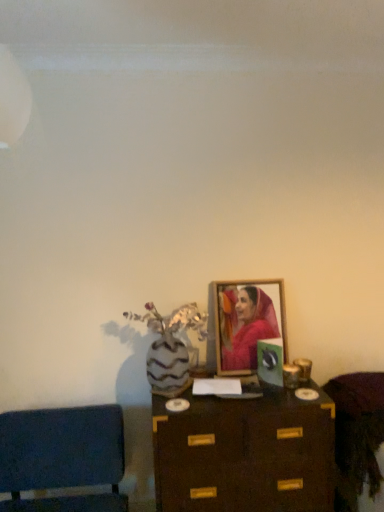
Identify the location of wooden cabinet at lower right, acting as the 1th furniture starting from the right. (357, 435).

Where is `velvet blue cushion at lower left, placed as the 1th furniture when sorted from left to right`? velvet blue cushion at lower left, placed as the 1th furniture when sorted from left to right is located at coordinates (62, 457).

Would you consider brown wooden table at center to be distant from wooden cabinet at lower right, the 2th furniture viewed from the left?

brown wooden table at center is near wooden cabinet at lower right, the 2th furniture viewed from the left, not far away.

How many degrees apart are the facing directions of brown wooden table at center and wooden cabinet at lower right, the 2th furniture viewed from the left?

There is a 0.159-degree angle between the facing directions of brown wooden table at center and wooden cabinet at lower right, the 2th furniture viewed from the left.

Based on their positions, is brown wooden table at center located to the left or right of wooden cabinet at lower right, acting as the 1th furniture starting from the right?

Clearly, brown wooden table at center is on the left of wooden cabinet at lower right, acting as the 1th furniture starting from the right, in the image.

From a real-world perspective, which is physically below, wooden cabinet at lower right, the 2th furniture viewed from the left, or velvet blue cushion at lower left, the 2th furniture in the right-to-left sequence?

In real-world perspective, velvet blue cushion at lower left, the 2th furniture in the right-to-left sequence, is lower.

Does wooden cabinet at lower right, acting as the 1th furniture starting from the right, have a larger size compared to velvet blue cushion at lower left, placed as the 1th furniture when sorted from left to right?

Incorrect, wooden cabinet at lower right, acting as the 1th furniture starting from the right, is not larger than velvet blue cushion at lower left, placed as the 1th furniture when sorted from left to right.

Can you confirm if wooden cabinet at lower right, the 2th furniture viewed from the left, is shorter than velvet blue cushion at lower left, placed as the 1th furniture when sorted from left to right?

Correct, wooden cabinet at lower right, the 2th furniture viewed from the left, is not as tall as velvet blue cushion at lower left, placed as the 1th furniture when sorted from left to right.

Is wooden cabinet at lower right, acting as the 1th furniture starting from the right, taller or shorter than wooden framed portrait at center?

In the image, wooden cabinet at lower right, acting as the 1th furniture starting from the right, appears to be shorter than wooden framed portrait at center.

Which of these two, wooden cabinet at lower right, the 2th furniture viewed from the left, or wooden framed portrait at center, is bigger?

wooden cabinet at lower right, the 2th furniture viewed from the left, is bigger.

From the image's perspective, which one is positioned lower, wooden cabinet at lower right, the 2th furniture viewed from the left, or wooden framed portrait at center?

From the image's view, wooden cabinet at lower right, the 2th furniture viewed from the left, is below.

Is wooden cabinet at lower right, acting as the 1th furniture starting from the right, inside or outside of wooden framed portrait at center?

wooden cabinet at lower right, acting as the 1th furniture starting from the right, exists outside the volume of wooden framed portrait at center.

Consider the image. Is wooden cabinet at lower right, the 2th furniture viewed from the left, smaller than brown wooden table at center?

Indeed, wooden cabinet at lower right, the 2th furniture viewed from the left, has a smaller size compared to brown wooden table at center.

From the image's perspective, which object appears higher, wooden cabinet at lower right, the 2th furniture viewed from the left, or brown wooden table at center?

wooden cabinet at lower right, the 2th furniture viewed from the left.

In terms of height, does wooden cabinet at lower right, the 2th furniture viewed from the left, look taller or shorter compared to brown wooden table at center?

In the image, wooden cabinet at lower right, the 2th furniture viewed from the left, appears to be shorter than brown wooden table at center.

From a real-world perspective, between wooden cabinet at lower right, acting as the 1th furniture starting from the right, and brown wooden table at center, who is vertically higher?

wooden cabinet at lower right, acting as the 1th furniture starting from the right, from a real-world perspective.

From the image's perspective, which is above, wooden framed portrait at center or velvet blue cushion at lower left, placed as the 1th furniture when sorted from left to right?

wooden framed portrait at center.

Can you confirm if wooden framed portrait at center is taller than velvet blue cushion at lower left, placed as the 1th furniture when sorted from left to right?

No, wooden framed portrait at center is not taller than velvet blue cushion at lower left, placed as the 1th furniture when sorted from left to right.

Locate an element on the screen. The image size is (384, 512). furniture on the left side of wooden framed portrait at center is located at coordinates (62, 457).

Which object is positioned more to the right, velvet blue cushion at lower left, the 2th furniture in the right-to-left sequence, or wooden framed portrait at center?

wooden framed portrait at center.

Considering the sizes of objects velvet blue cushion at lower left, placed as the 1th furniture when sorted from left to right, and wooden framed portrait at center in the image provided, who is taller, velvet blue cushion at lower left, placed as the 1th furniture when sorted from left to right, or wooden framed portrait at center?

velvet blue cushion at lower left, placed as the 1th furniture when sorted from left to right, is taller.

Where is `furniture to the left of wooden framed portrait at center`? This screenshot has height=512, width=384. furniture to the left of wooden framed portrait at center is located at coordinates (62, 457).

Is wooden framed portrait at center completely or partially inside velvet blue cushion at lower left, the 2th furniture in the right-to-left sequence?

No, velvet blue cushion at lower left, the 2th furniture in the right-to-left sequence, does not contain wooden framed portrait at center.

From a real-world perspective, which is physically below, velvet blue cushion at lower left, placed as the 1th furniture when sorted from left to right, or brown wooden table at center?

brown wooden table at center is physically lower.

Is point (121, 438) in front of point (285, 484)?

No, it is behind (285, 484).

From the image's perspective, who appears lower, velvet blue cushion at lower left, placed as the 1th furniture when sorted from left to right, or brown wooden table at center?

velvet blue cushion at lower left, placed as the 1th furniture when sorted from left to right, appears lower in the image.

Locate an element on the screen. table below the wooden cabinet at lower right, acting as the 1th furniture starting from the right (from the image's perspective) is located at coordinates (245, 454).

The width and height of the screenshot is (384, 512). I want to click on furniture located on the left of wooden cabinet at lower right, acting as the 1th furniture starting from the right, so click(x=62, y=457).

Looking at this image, based on their spatial positions, is wooden framed portrait at center or wooden cabinet at lower right, acting as the 1th furniture starting from the right, closer to brown wooden table at center?

wooden cabinet at lower right, acting as the 1th furniture starting from the right.

When comparing their distances from velvet blue cushion at lower left, the 2th furniture in the right-to-left sequence, does brown wooden table at center or wooden framed portrait at center seem closer?

Among the two, brown wooden table at center is located nearer to velvet blue cushion at lower left, the 2th furniture in the right-to-left sequence.

Estimate the real-world distances between objects in this image. Which object is further from velvet blue cushion at lower left, the 2th furniture in the right-to-left sequence, brown wooden table at center or wooden cabinet at lower right, the 2th furniture viewed from the left?

The object further to velvet blue cushion at lower left, the 2th furniture in the right-to-left sequence, is wooden cabinet at lower right, the 2th furniture viewed from the left.

Considering their positions, is wooden cabinet at lower right, the 2th furniture viewed from the left, positioned closer to wooden framed portrait at center than brown wooden table at center?

brown wooden table at center.

Based on their spatial positions, is velvet blue cushion at lower left, placed as the 1th furniture when sorted from left to right, or wooden cabinet at lower right, the 2th furniture viewed from the left, closer to wooden framed portrait at center?

Based on the image, wooden cabinet at lower right, the 2th furniture viewed from the left, appears to be nearer to wooden framed portrait at center.

Looking at the image, which one is located closer to brown wooden table at center, wooden framed portrait at center or velvet blue cushion at lower left, placed as the 1th furniture when sorted from left to right?

Based on the image, wooden framed portrait at center appears to be nearer to brown wooden table at center.

When comparing their distances from wooden framed portrait at center, does brown wooden table at center or velvet blue cushion at lower left, the 2th furniture in the right-to-left sequence, seem closer?

brown wooden table at center is positioned closer to the anchor wooden framed portrait at center.

Which object lies nearer to the anchor point brown wooden table at center, velvet blue cushion at lower left, the 2th furniture in the right-to-left sequence, or wooden framed portrait at center?

Based on the image, wooden framed portrait at center appears to be nearer to brown wooden table at center.

This screenshot has width=384, height=512. I want to click on table between velvet blue cushion at lower left, placed as the 1th furniture when sorted from left to right, and wooden framed portrait at center, in the horizontal direction, so tap(245, 454).

Locate an element on the screen. This screenshot has width=384, height=512. table located between velvet blue cushion at lower left, the 2th furniture in the right-to-left sequence, and wooden cabinet at lower right, acting as the 1th furniture starting from the right, in the left-right direction is located at coordinates (245, 454).

Image resolution: width=384 pixels, height=512 pixels. What are the coordinates of `furniture between wooden framed portrait at center and brown wooden table at center in the vertical direction` in the screenshot? It's located at (357, 435).

Find the location of `picture frame situated between velvet blue cushion at lower left, the 2th furniture in the right-to-left sequence, and wooden cabinet at lower right, acting as the 1th furniture starting from the right, from left to right`. picture frame situated between velvet blue cushion at lower left, the 2th furniture in the right-to-left sequence, and wooden cabinet at lower right, acting as the 1th furniture starting from the right, from left to right is located at coordinates (247, 323).